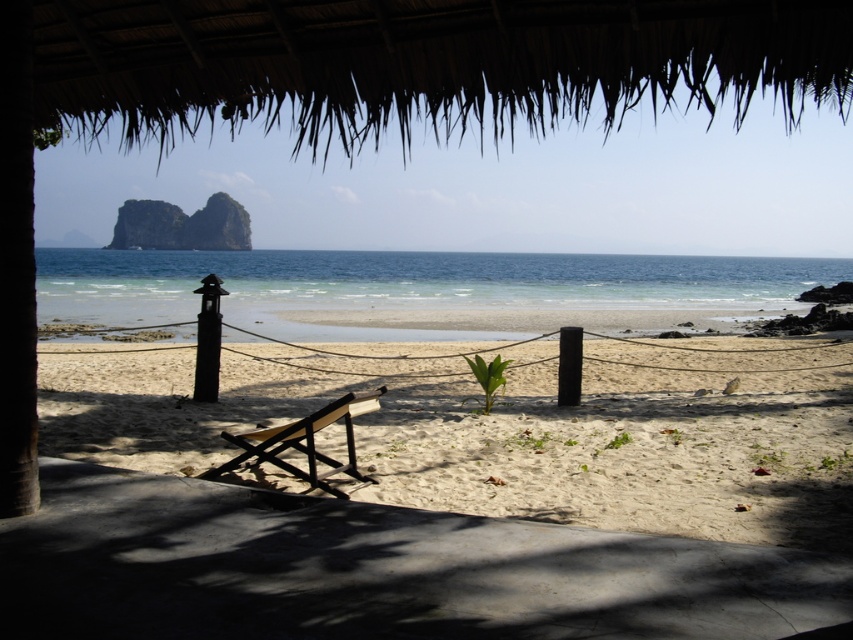
Question: Which point is closer to the camera?

Choices:
 (A) black matte pole at center
 (B) wooden chair at center
 (C) light beige sand at center

Answer: (C)

Question: Estimate the real-world distances between objects in this image. Which object is farther from the black wood pole at left?

Choices:
 (A) black matte pole at center
 (B) light beige sand at center

Answer: (B)

Question: Is light beige sand at center below black matte pole at center?

Choices:
 (A) yes
 (B) no

Answer: (A)

Question: Considering the real-world distances, which object is farthest from the black matte pole at center?

Choices:
 (A) light beige sand at center
 (B) black wood pole at left
 (C) wooden chair at center

Answer: (A)

Question: Can you confirm if black wood pole at left is positioned to the right of black matte pole at center?

Choices:
 (A) yes
 (B) no

Answer: (B)

Question: Does light beige sand at center have a larger size compared to black wood pole at left?

Choices:
 (A) no
 (B) yes

Answer: (B)